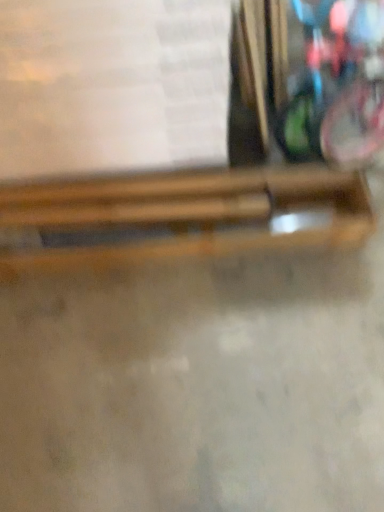
Question: Which is correct: wooden chopsticks at center, which is counted as the second wood, starting from the top, is inside wooden chopsticks at center, which is the first wood in top-to-bottom order, or outside of it?

Choices:
 (A) outside
 (B) inside

Answer: (A)

Question: In the image, is wooden chopsticks at center, which is counted as the second wood, starting from the top, positioned in front of or behind wooden chopsticks at center, the second wood in the bottom-to-top sequence?

Choices:
 (A) behind
 (B) front

Answer: (B)

Question: Which is nearer to the wooden chopsticks at center, which is counted as the second wood, starting from the top?

Choices:
 (A) wooden chopsticks at center, which is the first wood in top-to-bottom order
 (B) white paper at upper center

Answer: (A)

Question: Considering the real-world distances, which object is closest to the wooden chopsticks at center, which is the first wood in top-to-bottom order?

Choices:
 (A) white paper at upper center
 (B) wooden chopsticks at center, which is the 1th wood from bottom to top

Answer: (B)